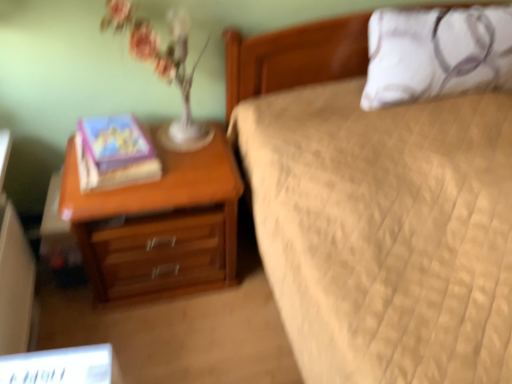
Question: Can you confirm if matte purple book at left is taller than wooden nightstand at left?

Choices:
 (A) yes
 (B) no

Answer: (B)

Question: From the image's perspective, does matte purple book at left appear lower than wooden nightstand at left?

Choices:
 (A) yes
 (B) no

Answer: (B)

Question: Is the surface of matte purple book at left in direct contact with wooden nightstand at left?

Choices:
 (A) no
 (B) yes

Answer: (A)

Question: From the image's perspective, is matte purple book at left located above wooden nightstand at left?

Choices:
 (A) yes
 (B) no

Answer: (A)

Question: Is matte purple book at left positioned behind wooden nightstand at left?

Choices:
 (A) no
 (B) yes

Answer: (B)

Question: Does matte purple book at left turn towards wooden nightstand at left?

Choices:
 (A) no
 (B) yes

Answer: (A)

Question: Considering the relative sizes of white textured pillow at upper right and matte purple book at left in the image provided, is white textured pillow at upper right wider than matte purple book at left?

Choices:
 (A) yes
 (B) no

Answer: (B)

Question: Is white textured pillow at upper right further to camera compared to matte purple book at left?

Choices:
 (A) yes
 (B) no

Answer: (A)

Question: Does white textured pillow at upper right appear on the right side of matte purple book at left?

Choices:
 (A) no
 (B) yes

Answer: (B)

Question: Is white textured pillow at upper right shorter than matte purple book at left?

Choices:
 (A) yes
 (B) no

Answer: (B)

Question: Does white textured pillow at upper right touch matte purple book at left?

Choices:
 (A) no
 (B) yes

Answer: (A)

Question: Is white textured pillow at upper right looking in the opposite direction of matte purple book at left?

Choices:
 (A) yes
 (B) no

Answer: (B)

Question: Considering the relative positions of wooden nightstand at left and matte purple book at left in the image provided, is wooden nightstand at left to the left of matte purple book at left from the viewer's perspective?

Choices:
 (A) no
 (B) yes

Answer: (A)